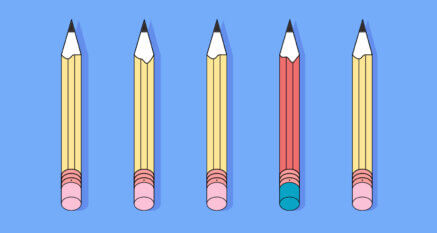
At what (x,y) coordinates should I click in order to perform the action: click on empty space left of pencils. Please return your answer as a coordinate pair (x, y). Looking at the image, I should click on (18, 103).